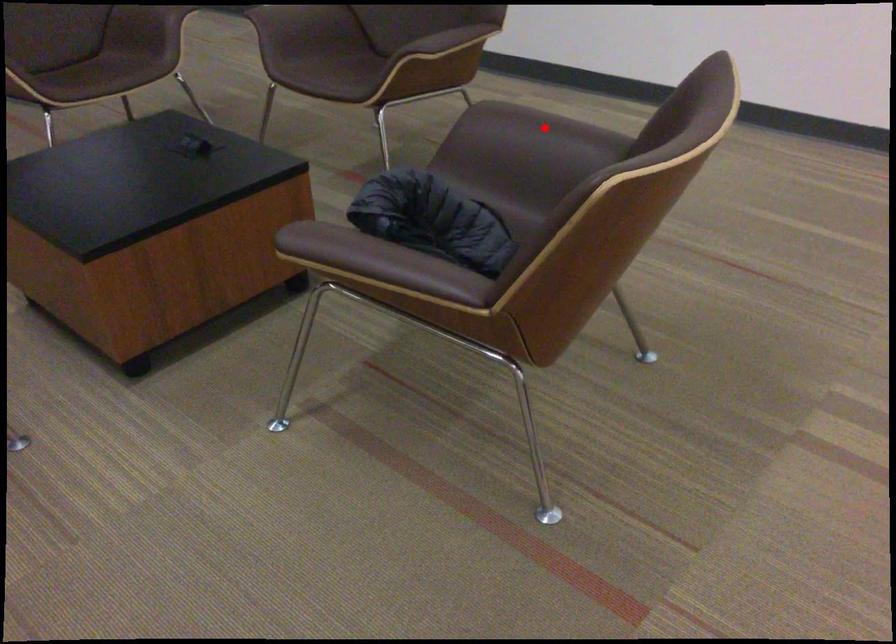
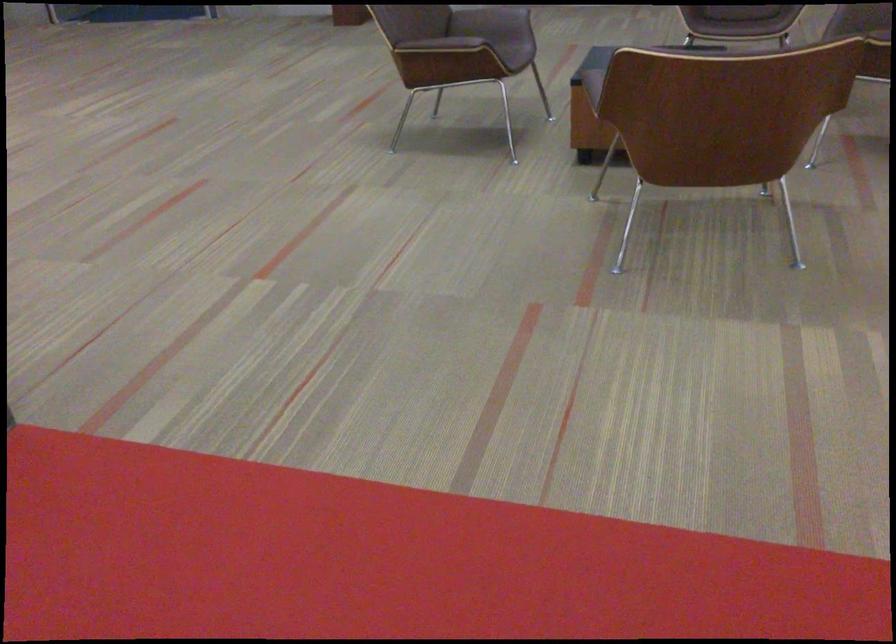
Question: I am providing you with two images of the same scene from different viewpoints. A red point is marked on the first image. At the location where the point appears in image 1, is it still visible in image 2?

Choices:
 (A) Yes
 (B) No

Answer: (B)